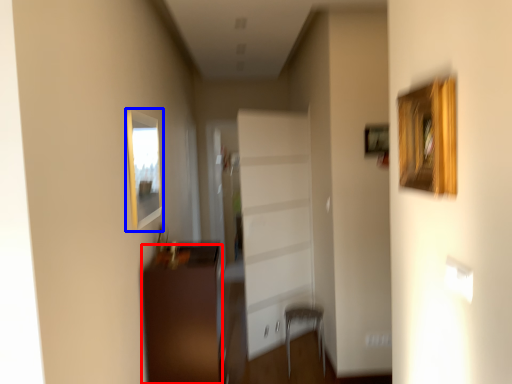
Question: Which point is further to the camera, furniture (highlighted by a red box) or picture frame (highlighted by a blue box)?

Choices:
 (A) furniture
 (B) picture frame

Answer: (A)